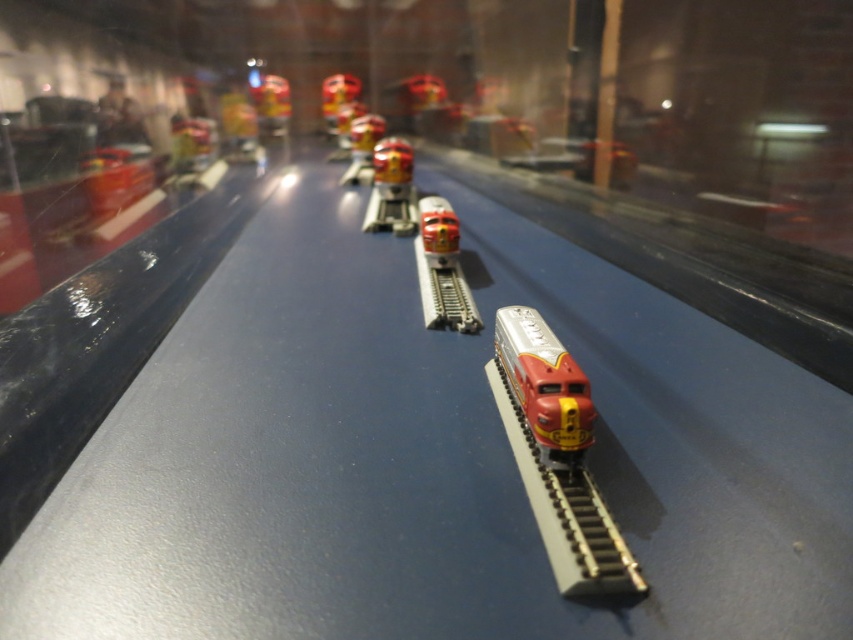
Question: Which object appears farthest from the camera in this image?

Choices:
 (A) metallic red train at center
 (B) glossy plastic train at center
 (C) glossy red train at center
 (D) metallic red train at upper center

Answer: (D)

Question: Is metallic gray train track at center above glossy red train at center?

Choices:
 (A) no
 (B) yes

Answer: (A)

Question: Can you confirm if metallic gray train track at center is bigger than shiny red train at upper center?

Choices:
 (A) yes
 (B) no

Answer: (B)

Question: Which object appears closest to the camera in this image?

Choices:
 (A) shiny silver train at center
 (B) glossy plastic train at center
 (C) metallic red train at upper center

Answer: (A)

Question: Does shiny metallic train at center have a lesser width compared to glossy red train at center?

Choices:
 (A) no
 (B) yes

Answer: (A)

Question: Among these objects, which one is farthest from the camera?

Choices:
 (A) metallic red train at center
 (B) shiny red train at upper center

Answer: (B)